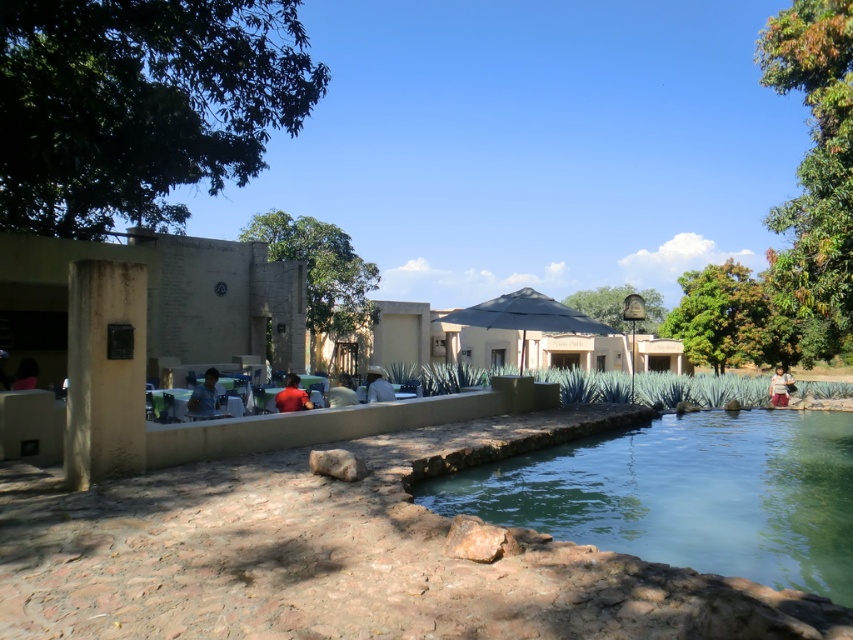
Who is shorter, white cotton shirt at center or dark blue shirt at left?

dark blue shirt at left is shorter.

Can you confirm if white cotton shirt at center is wider than dark blue shirt at left?

Yes, white cotton shirt at center is wider than dark blue shirt at left.

Between point (376, 371) and point (25, 362), which one is positioned behind?

Positioned behind is point (376, 371).

Image resolution: width=853 pixels, height=640 pixels. I want to click on white cotton shirt at center, so click(x=378, y=385).

Is point (718, 513) closer to camera compared to point (199, 400)?

That is True.

Does clear glass pool at center have a lesser height compared to blue denim shirt at lower left?

Correct, clear glass pool at center is not as tall as blue denim shirt at lower left.

This screenshot has width=853, height=640. What are the coordinates of `clear glass pool at center` in the screenshot? It's located at (688, 493).

Which is in front, point (202, 412) or point (19, 381)?

Point (202, 412) is in front.

What do you see at coordinates (204, 394) in the screenshot? I see `blue denim shirt at lower left` at bounding box center [204, 394].

Where is `blue denim shirt at lower left`? The height and width of the screenshot is (640, 853). blue denim shirt at lower left is located at coordinates (204, 394).

Locate an element on the screen. Image resolution: width=853 pixels, height=640 pixels. blue denim shirt at lower left is located at coordinates 204,394.